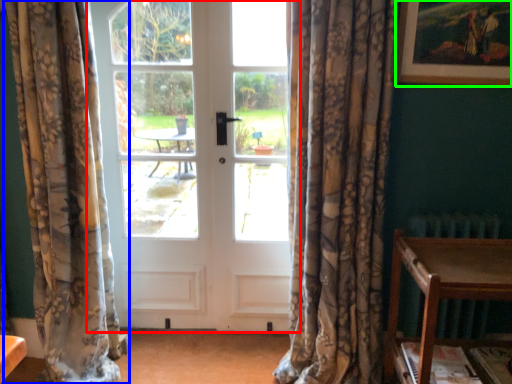
Question: Which object is positioned farthest from door (highlighted by a red box)? Select from curtain (highlighted by a blue box) and picture frame (highlighted by a green box).

Choices:
 (A) curtain
 (B) picture frame

Answer: (B)